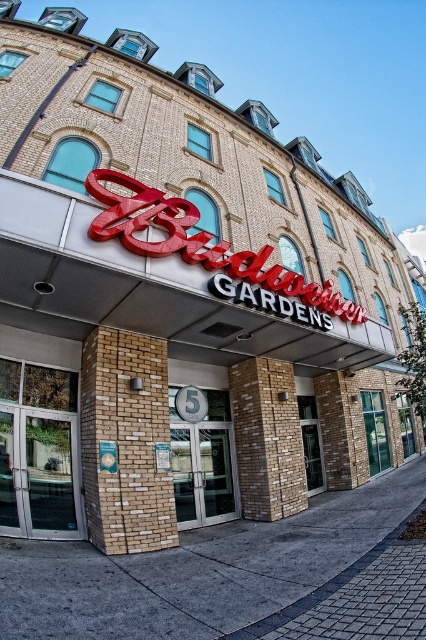
Can you confirm if clear glass door at center is thinner than silver metallic doors at center?

Yes, clear glass door at center is thinner than silver metallic doors at center.

How much distance is there between clear glass door at center and silver metallic doors at center?

clear glass door at center and silver metallic doors at center are 2.22 meters apart.

Which is in front, point (71, 481) or point (181, 468)?

Positioned in front is point (71, 481).

Where is `clear glass door at center`? The width and height of the screenshot is (426, 640). clear glass door at center is located at coordinates (37, 476).